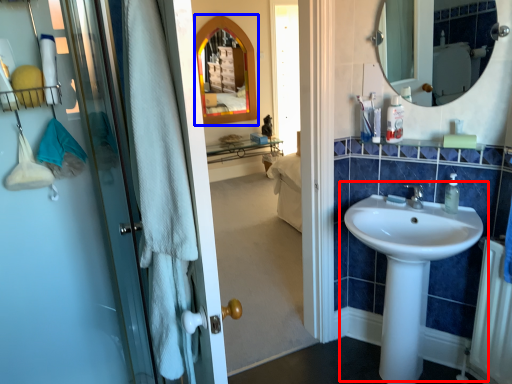
Question: Among these objects, which one is nearest to the camera, sink (highlighted by a red box) or medicine cabinet (highlighted by a blue box)?

Choices:
 (A) sink
 (B) medicine cabinet

Answer: (A)